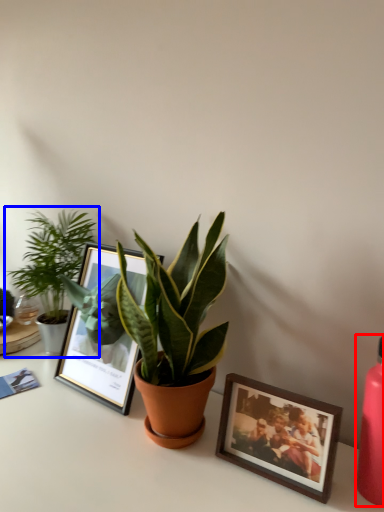
Question: Among these objects, which one is nearest to the camera, bottle (highlighted by a red box) or houseplant (highlighted by a blue box)?

Choices:
 (A) bottle
 (B) houseplant

Answer: (A)